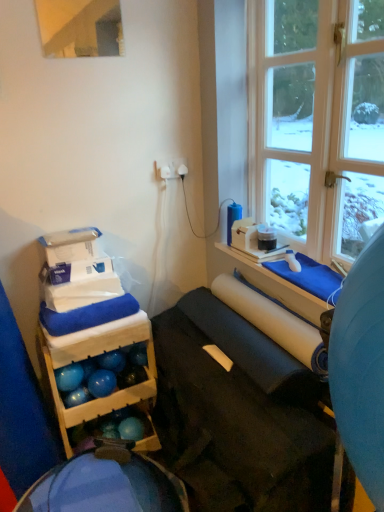
Question: Could you tell me if blue fabric bean bag at lower left is facing white matte paper towel at center?

Choices:
 (A) no
 (B) yes

Answer: (A)

Question: Considering the relative sizes of blue fabric bean bag at lower left and white matte paper towel at center in the image provided, is blue fabric bean bag at lower left thinner than white matte paper towel at center?

Choices:
 (A) no
 (B) yes

Answer: (A)

Question: Does blue fabric bean bag at lower left appear on the left side of white matte paper towel at center?

Choices:
 (A) yes
 (B) no

Answer: (A)

Question: Can you confirm if blue fabric bean bag at lower left is wider than white matte paper towel at center?

Choices:
 (A) yes
 (B) no

Answer: (A)

Question: From the image's perspective, would you say blue fabric bean bag at lower left is shown under white matte paper towel at center?

Choices:
 (A) yes
 (B) no

Answer: (A)

Question: Is point (102, 459) closer or farther from the camera than point (208, 430)?

Choices:
 (A) closer
 (B) farther

Answer: (B)

Question: Based on their sizes in the image, would you say blue fabric bean bag at lower left is bigger or smaller than matte black yoga mat at center?

Choices:
 (A) big
 (B) small

Answer: (B)

Question: Considering the positions of blue fabric bean bag at lower left and matte black yoga mat at center in the image, is blue fabric bean bag at lower left taller or shorter than matte black yoga mat at center?

Choices:
 (A) tall
 (B) short

Answer: (B)

Question: Considering the positions of blue fabric bean bag at lower left and matte black yoga mat at center in the image, is blue fabric bean bag at lower left wider or thinner than matte black yoga mat at center?

Choices:
 (A) thin
 (B) wide

Answer: (A)

Question: In terms of height, does white matte paper towel at center look taller or shorter compared to blue fabric bean bag at lower left?

Choices:
 (A) tall
 (B) short

Answer: (B)

Question: Based on their sizes in the image, would you say white matte paper towel at center is bigger or smaller than blue fabric bean bag at lower left?

Choices:
 (A) small
 (B) big

Answer: (A)

Question: From a real-world perspective, is white matte paper towel at center above or below blue fabric bean bag at lower left?

Choices:
 (A) above
 (B) below

Answer: (A)

Question: From the image's perspective, relative to blue fabric bean bag at lower left, is white matte paper towel at center above or below?

Choices:
 (A) below
 (B) above

Answer: (B)

Question: Considering the relative positions of white matte paper towel at center and matte black yoga mat at center in the image provided, is white matte paper towel at center to the left or to the right of matte black yoga mat at center?

Choices:
 (A) left
 (B) right

Answer: (B)

Question: Considering their positions, is white matte paper towel at center located in front of or behind matte black yoga mat at center?

Choices:
 (A) front
 (B) behind

Answer: (B)